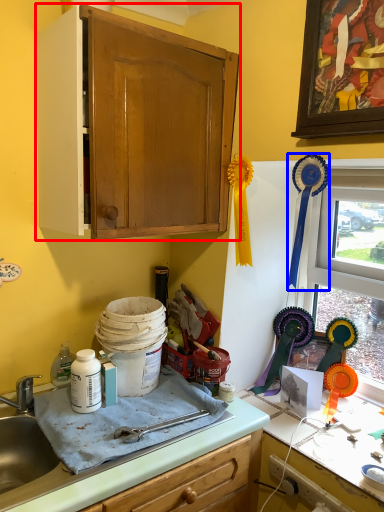
Question: Among these objects, which one is farthest to the camera, cabinetry (highlighted by a red box) or brush (highlighted by a blue box)?

Choices:
 (A) cabinetry
 (B) brush

Answer: (B)